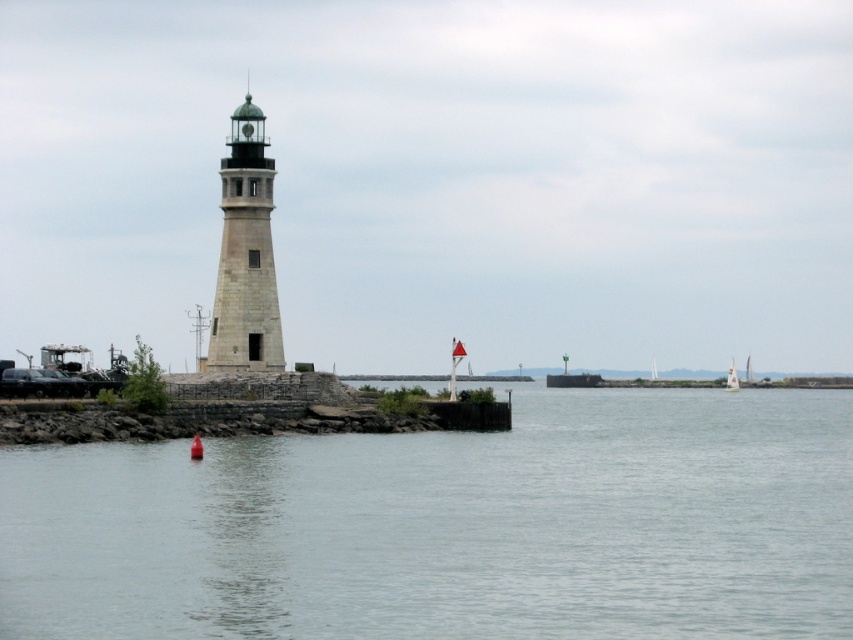
Question: Is white stone lighthouse at left to the left of white sailboat at center from the viewer's perspective?

Choices:
 (A) yes
 (B) no

Answer: (A)

Question: Does clear water at center appear under white stone lighthouse at left?

Choices:
 (A) no
 (B) yes

Answer: (B)

Question: Among these objects, which one is farthest from the camera?

Choices:
 (A) white stone lighthouse at left
 (B) white sailboat at center
 (C) clear water at center

Answer: (B)

Question: Among these objects, which one is farthest from the camera?

Choices:
 (A) white stone lighthouse at left
 (B) clear water at center
 (C) white sailboat at center

Answer: (C)

Question: Is the position of clear water at center more distant than that of white sailboat at center?

Choices:
 (A) yes
 (B) no

Answer: (B)

Question: Which of the following is the closest to the observer?

Choices:
 (A) white sailboat at center
 (B) clear water at center
 (C) white stone lighthouse at left

Answer: (B)